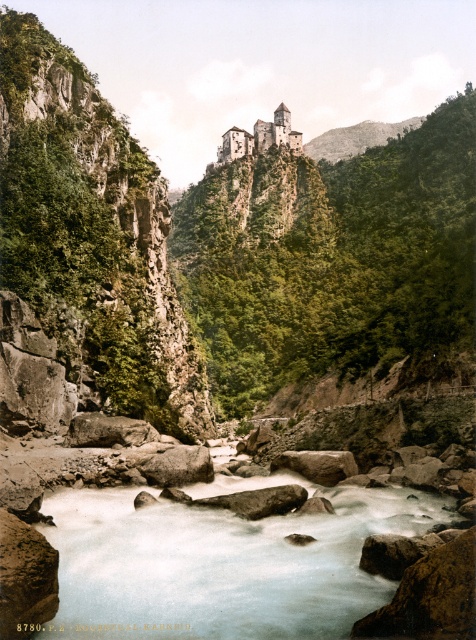
Question: Which object appears farthest from the camera in this image?

Choices:
 (A) green rocky mountain at upper center
 (B) smooth rock river at center
 (C) brown stone castle at upper center

Answer: (A)

Question: Is smooth rock river at center thinner than green rocky mountain at upper center?

Choices:
 (A) yes
 (B) no

Answer: (A)

Question: Which point is farther to the camera?

Choices:
 (A) brown stone castle at upper center
 (B) green rocky mountain at upper center

Answer: (B)

Question: Is green rocky mountain at upper center closer to camera compared to brown stone castle at upper center?

Choices:
 (A) yes
 (B) no

Answer: (B)

Question: From the image, what is the correct spatial relationship of green rocky mountain at upper center in relation to brown stone castle at upper center?

Choices:
 (A) below
 (B) above

Answer: (B)

Question: Considering the real-world distances, which object is closest to the green rocky mountain at upper center?

Choices:
 (A) brown stone castle at upper center
 (B) smooth rock river at center

Answer: (A)